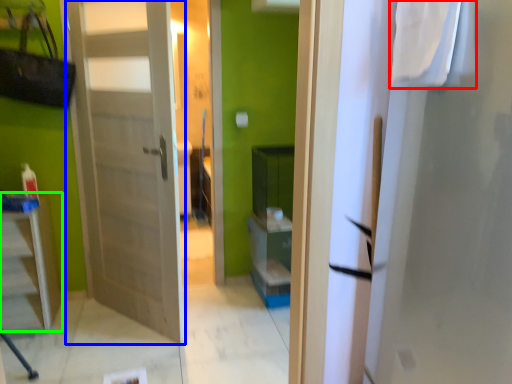
Question: Based on their relative distances, which object is nearer to laundry (highlighted by a red box)? Choose from door (highlighted by a blue box) and furniture (highlighted by a green box).

Choices:
 (A) door
 (B) furniture

Answer: (A)